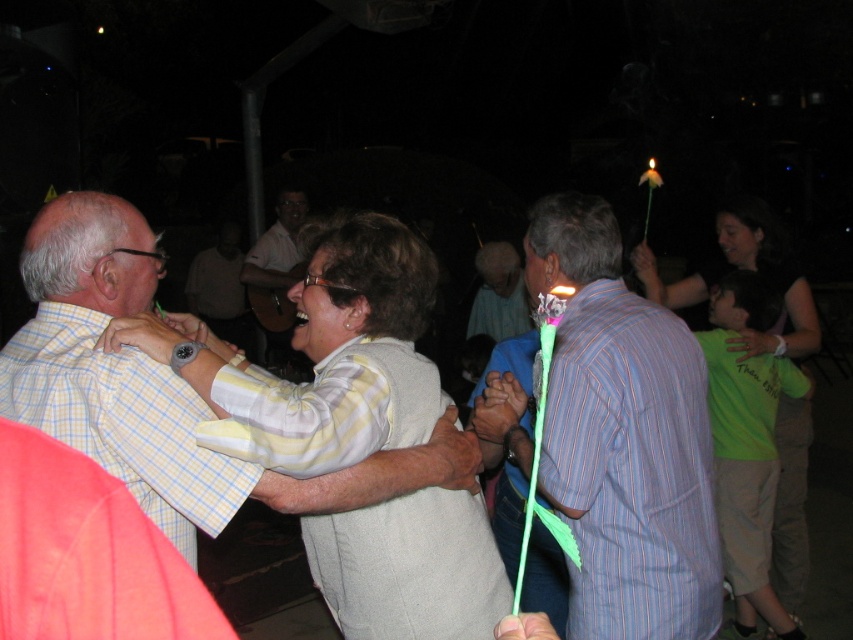
Question: Which of the following is the closest to the observer?

Choices:
 (A) yellow checkered shirt at left
 (B) matte white shirt at center
 (C) green fabric shirt at right
 (D) light blue striped shirt at center

Answer: (A)

Question: Is light gray sweater at center smaller than yellow checkered shirt at left?

Choices:
 (A) no
 (B) yes

Answer: (A)

Question: Where is matte white shirt at center located in relation to light blue striped shirt at center in the image?

Choices:
 (A) left
 (B) right

Answer: (A)

Question: Based on their relative distances, which object is farther from the light blue striped shirt at center?

Choices:
 (A) green fabric shirt at right
 (B) matte white shirt at center
 (C) light gray sweater at center

Answer: (C)

Question: Does light gray sweater at center appear on the left side of light blue striped shirt at center?

Choices:
 (A) no
 (B) yes

Answer: (B)

Question: Which point is farther from the camera taking this photo?

Choices:
 (A) (175, 340)
 (B) (697, 448)
 (C) (744, 316)

Answer: (C)